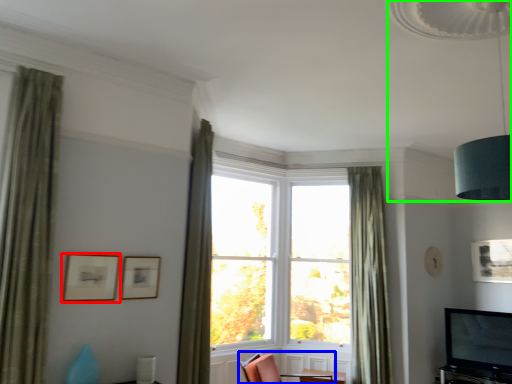
Question: Which object is the farthest from picture frame (highlighted by a red box)? Choose among these: chair (highlighted by a blue box) or lamp (highlighted by a green box).

Choices:
 (A) chair
 (B) lamp

Answer: (B)